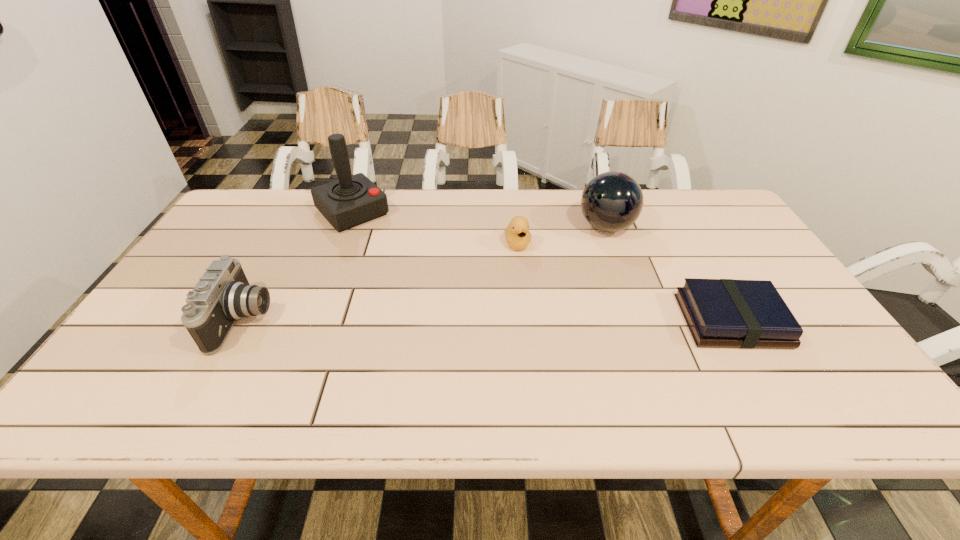
Image resolution: width=960 pixels, height=540 pixels. Find the location of `vacant space located 0.160m on the face of the duckling`. vacant space located 0.160m on the face of the duckling is located at coordinates (532, 294).

Where is `free space located 0.100m on the face of the duckling`? This screenshot has height=540, width=960. free space located 0.100m on the face of the duckling is located at coordinates (527, 279).

I want to click on vacant space located on the face of the duckling, so click(529, 284).

Where is `vacant area situated 0.290m on the side of the second object from right to left with the finger holes`? This screenshot has height=540, width=960. vacant area situated 0.290m on the side of the second object from right to left with the finger holes is located at coordinates (517, 280).

Locate an element on the screen. The width and height of the screenshot is (960, 540). blank area located on the side of the second object from right to left with the finger holes is located at coordinates (536, 269).

The height and width of the screenshot is (540, 960). I want to click on vacant region located 0.050m on the side of the second object from right to left with the finger holes, so click(576, 245).

Where is `vacant space located on the base of the tallest object`? This screenshot has height=540, width=960. vacant space located on the base of the tallest object is located at coordinates (419, 281).

Image resolution: width=960 pixels, height=540 pixels. What are the coordinates of `blank space located 0.190m on the base of the tallest object` in the screenshot? It's located at coord(400,262).

Find the location of `vacant space located 0.270m on the base of the tallest object`. vacant space located 0.270m on the base of the tallest object is located at coordinates 415,277.

At what (x,y) coordinates should I click in order to perform the action: click on bowling ball at the far edge. Please return your answer as a coordinate pair (x, y). Looking at the image, I should click on (612, 201).